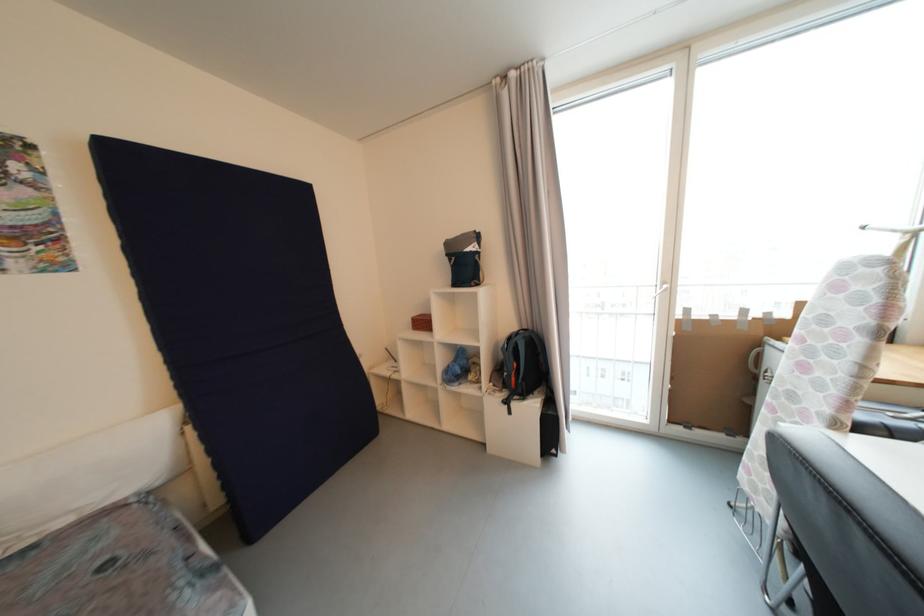
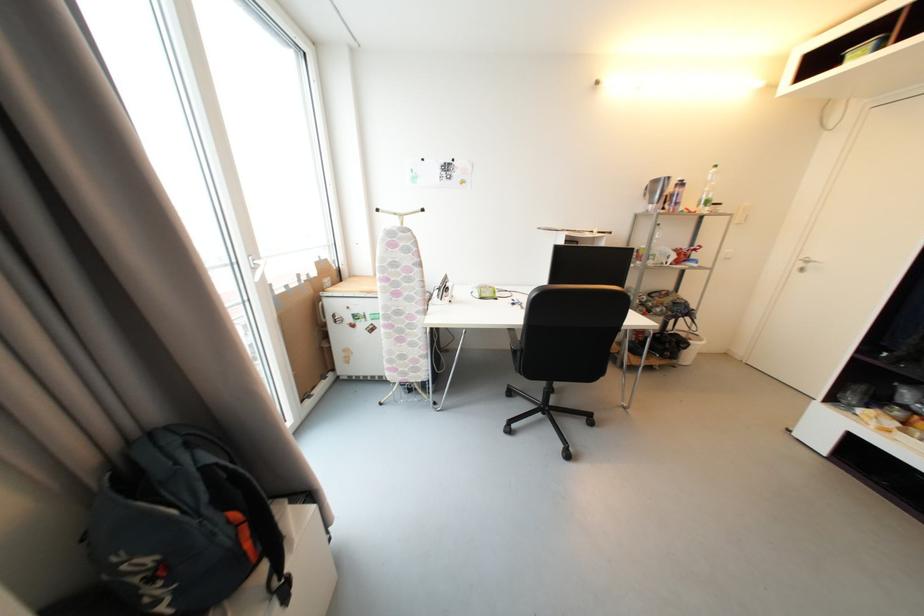
The point at (773, 350) is marked in the first image. Where is the corresponding point in the second image?

(330, 302)